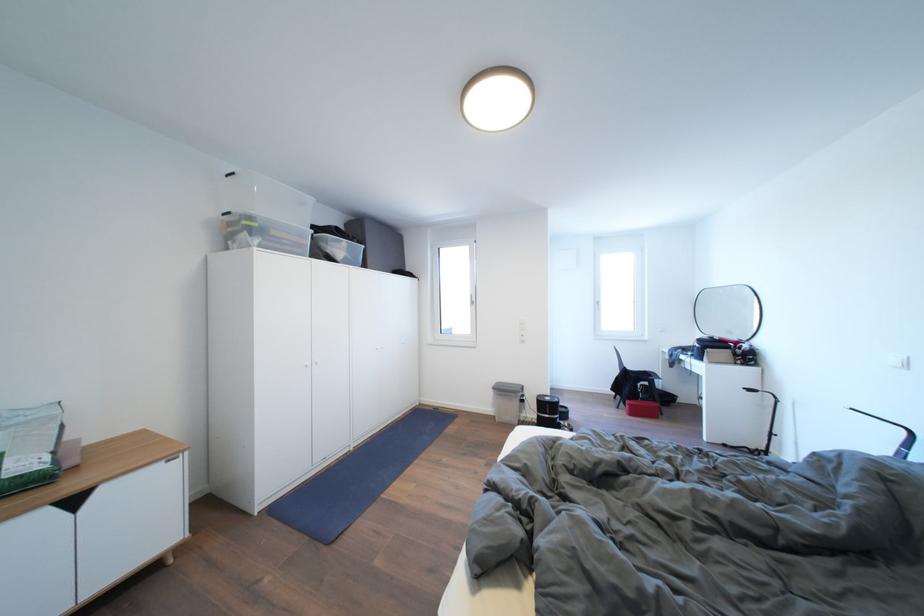
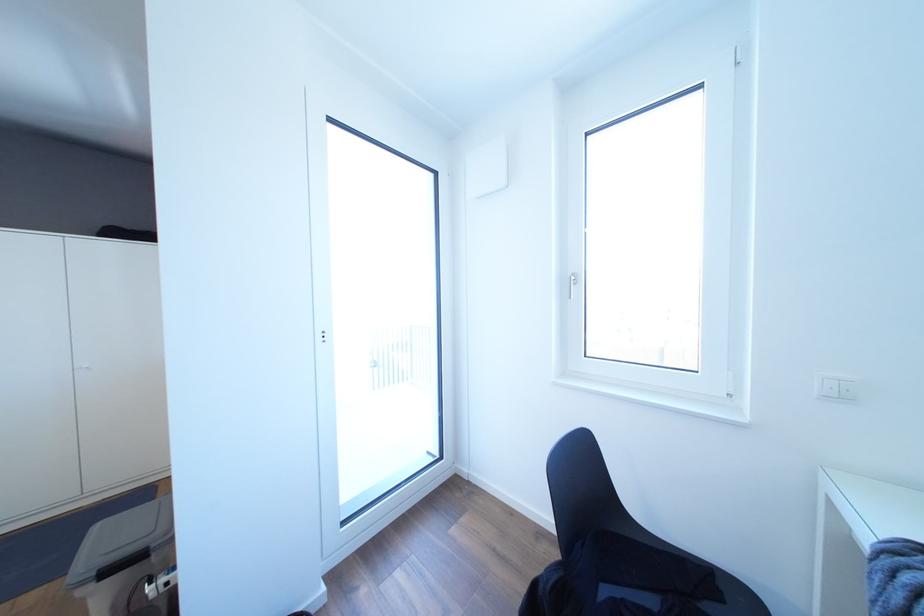
In a continuous first-person perspective shot, in which direction is the camera moving?

The movement direction of the cameraman is right, forward.